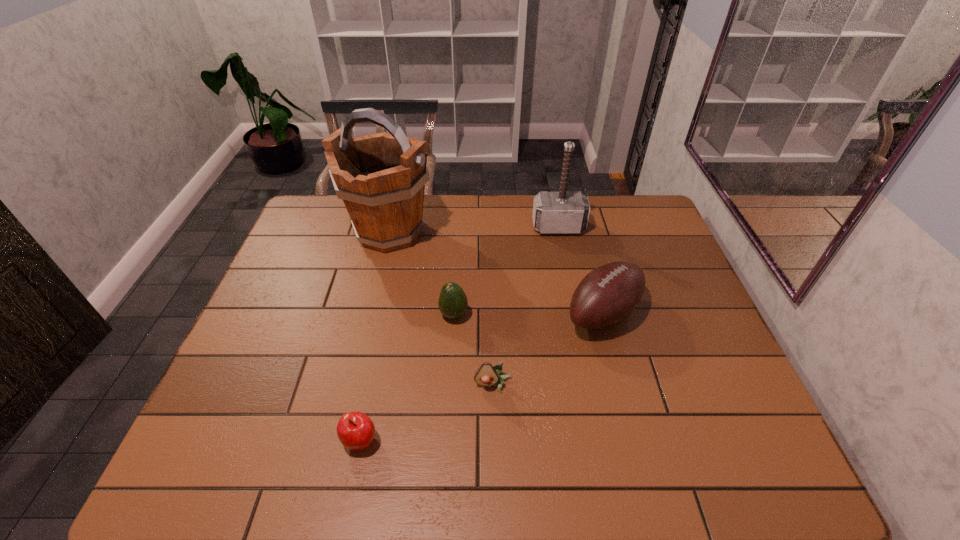
At what (x,y) coordinates should I click in order to perform the action: click on bucket. Please return your answer as a coordinate pair (x, y). The height and width of the screenshot is (540, 960). Looking at the image, I should click on (381, 178).

At what (x,y) coordinates should I click in order to perform the action: click on the second tallest object. Please return your answer as a coordinate pair (x, y). Image resolution: width=960 pixels, height=540 pixels. Looking at the image, I should click on (562, 212).

Where is `the third tallest object`? This screenshot has height=540, width=960. the third tallest object is located at coordinates (608, 294).

Locate an element on the screen. the left avocado is located at coordinates (453, 303).

You are a GUI agent. You are given a task and a screenshot of the screen. Output one action in this format:
    pyautogui.click(x=<x>, y=<y>)
    Task: Click on the fourth object from right to left
    The height and width of the screenshot is (540, 960).
    Given the screenshot: What is the action you would take?
    pyautogui.click(x=453, y=303)

At what (x,y) coordinates should I click in order to perform the action: click on the shorter avocado. Please return your answer as a coordinate pair (x, y). The height and width of the screenshot is (540, 960). Looking at the image, I should click on (486, 375).

Where is `the second nearest object`? Image resolution: width=960 pixels, height=540 pixels. the second nearest object is located at coordinates (486, 375).

At what (x,y) coordinates should I click in order to perform the action: click on the nearest object. Please return your answer as a coordinate pair (x, y). The width and height of the screenshot is (960, 540). Looking at the image, I should click on (356, 431).

The image size is (960, 540). I want to click on free location located on the front of the bucket, so click(363, 345).

The width and height of the screenshot is (960, 540). Identify the location of vacant space located for striking with the head of the fifth shortest object. (568, 276).